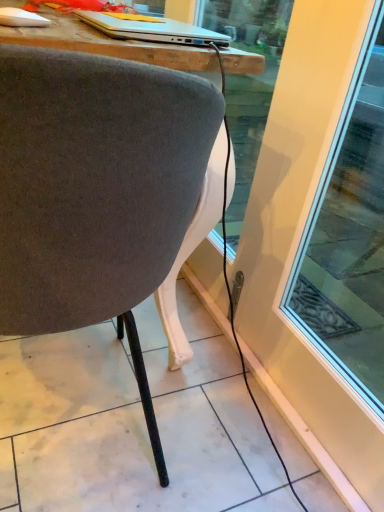
Question: Choose the correct answer: Is velvet gray chair at center inside silver metallic laptop at upper center or outside it?

Choices:
 (A) inside
 (B) outside

Answer: (B)

Question: From the image's perspective, relative to silver metallic laptop at upper center, is velvet gray chair at center above or below?

Choices:
 (A) above
 (B) below

Answer: (B)

Question: In terms of width, does velvet gray chair at center look wider or thinner when compared to silver metallic laptop at upper center?

Choices:
 (A) thin
 (B) wide

Answer: (B)

Question: In terms of width, does silver metallic laptop at upper center look wider or thinner when compared to velvet gray chair at center?

Choices:
 (A) wide
 (B) thin

Answer: (B)

Question: Is silver metallic laptop at upper center to the left or to the right of velvet gray chair at center in the image?

Choices:
 (A) right
 (B) left

Answer: (A)

Question: In terms of height, does silver metallic laptop at upper center look taller or shorter compared to velvet gray chair at center?

Choices:
 (A) short
 (B) tall

Answer: (A)

Question: Is point (127, 28) closer or farther from the camera than point (125, 103)?

Choices:
 (A) closer
 (B) farther

Answer: (B)